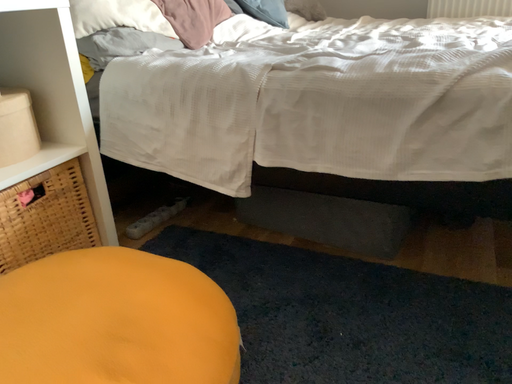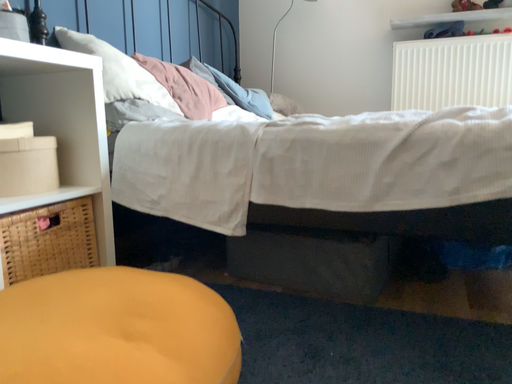
Question: How did the camera likely rotate when shooting the video?

Choices:
 (A) rotated upward
 (B) rotated downward

Answer: (A)